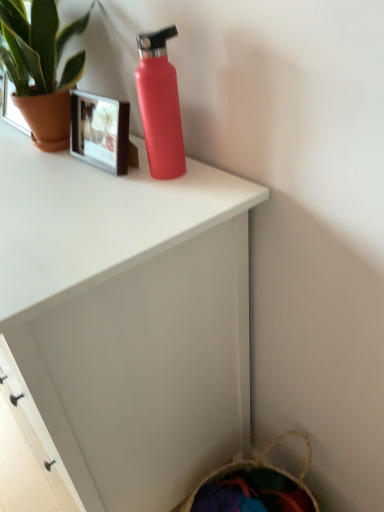
Locate an element on the screen. vacant space to the left of matte pink bottle at upper center is located at coordinates (77, 185).